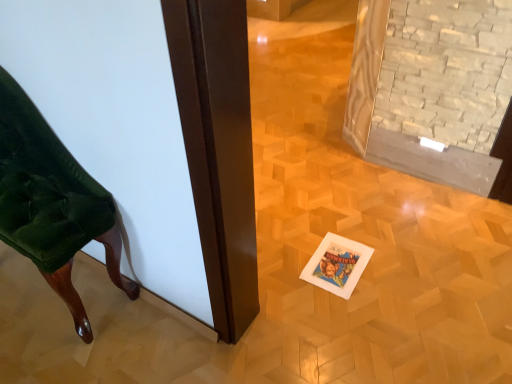
Question: From a real-world perspective, is velvet green chair at left physically located above or below white paper postcard at center?

Choices:
 (A) below
 (B) above

Answer: (B)

Question: In terms of height, does velvet green chair at left look taller or shorter compared to white paper postcard at center?

Choices:
 (A) tall
 (B) short

Answer: (A)

Question: Is velvet green chair at left in front of or behind white paper postcard at center in the image?

Choices:
 (A) front
 (B) behind

Answer: (A)

Question: Considering the positions of point (309, 266) and point (1, 96), is point (309, 266) closer or farther from the camera than point (1, 96)?

Choices:
 (A) closer
 (B) farther

Answer: (B)

Question: From a real-world perspective, is white paper postcard at center positioned above or below velvet green chair at left?

Choices:
 (A) below
 (B) above

Answer: (A)

Question: In the image, is white paper postcard at center positioned in front of or behind velvet green chair at left?

Choices:
 (A) front
 (B) behind

Answer: (B)

Question: Choose the correct answer: Is white paper postcard at center inside velvet green chair at left or outside it?

Choices:
 (A) inside
 (B) outside

Answer: (B)